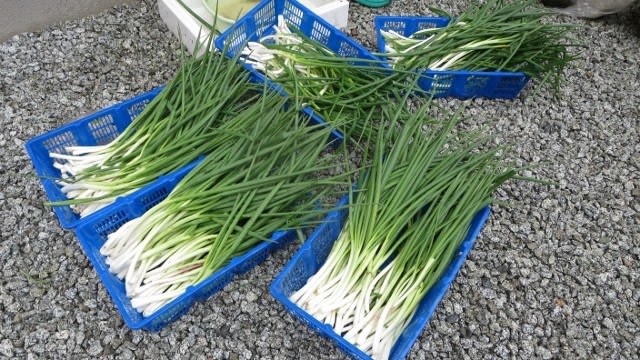
Locate an element on the screen. The image size is (640, 360). bin is located at coordinates (64, 138), (106, 225), (292, 281), (242, 37), (404, 26).